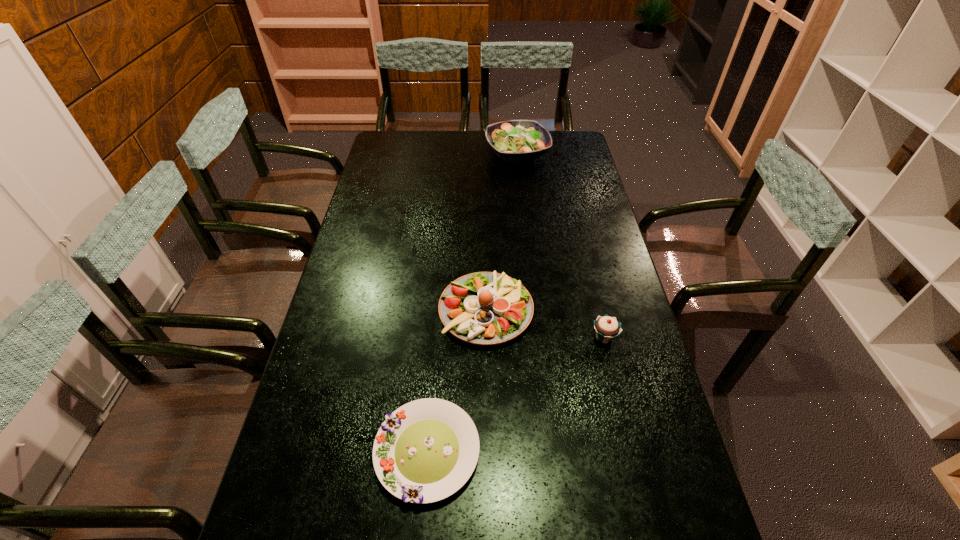
This screenshot has height=540, width=960. In order to click on object that is at the far edge in this screenshot , I will do `click(515, 140)`.

You are a GUI agent. You are given a task and a screenshot of the screen. Output one action in this format:
    pyautogui.click(x=<x>, y=<y>)
    Task: Click on the salad plate that is at the right edge
    
    Given the screenshot: What is the action you would take?
    515,140

In order to click on cupcake that is at the right edge in this screenshot , I will do `click(607, 328)`.

Identify the location of object located at the far right corner. The image size is (960, 540). (515, 140).

In the image, there is a desktop. At what (x,y) coordinates should I click in order to perform the action: click on vacant space at the far edge. Please return your answer as a coordinate pair (x, y). Looking at the image, I should click on (542, 156).

I want to click on free region at the left edge of the desktop, so click(x=372, y=299).

This screenshot has height=540, width=960. Find the location of `free point at the right edge`. free point at the right edge is located at coordinates (648, 390).

In the image, there is a desktop. Where is `vacant space at the far left corner`? vacant space at the far left corner is located at coordinates (409, 156).

Where is `free point between the tallest salad plate and the second shortest salad plate`? Image resolution: width=960 pixels, height=540 pixels. free point between the tallest salad plate and the second shortest salad plate is located at coordinates (502, 232).

At what (x,y) coordinates should I click in order to perform the action: click on vacant point located between the second tallest salad plate and the cupcake. Please return your answer as a coordinate pair (x, y). This screenshot has height=540, width=960. Looking at the image, I should click on pos(545,324).